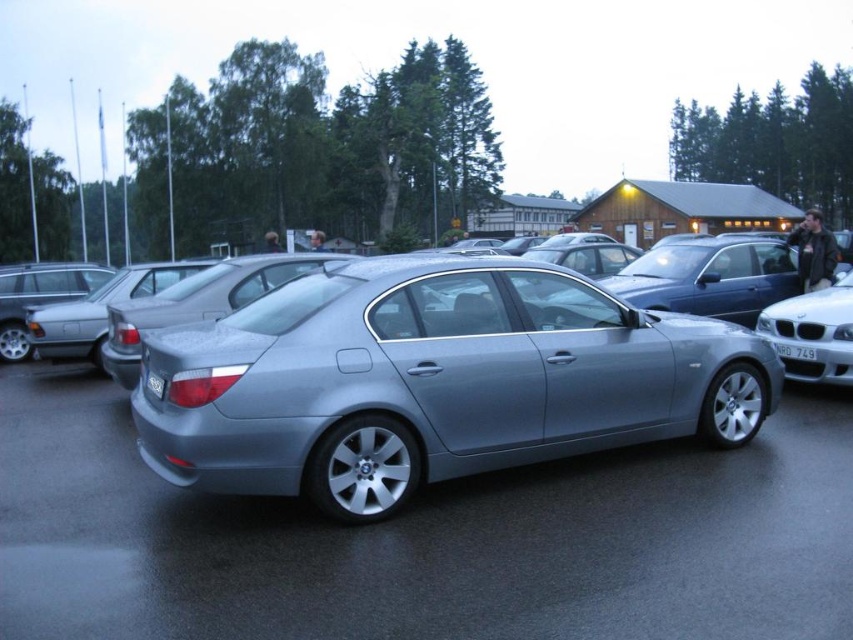
Which is above, white plastic license plate at center or black plastic license plate at center?

white plastic license plate at center is higher up.

Is point (793, 352) behind point (161, 385)?

That is True.

Identify the location of white plastic license plate at center. (795, 352).

Is satin white car at right thinner than white plastic license plate at center?

Incorrect, satin white car at right's width is not less than white plastic license plate at center's.

Between satin white car at right and white plastic license plate at center, which one is positioned higher?

satin white car at right

The width and height of the screenshot is (853, 640). Find the location of `satin white car at right`. satin white car at right is located at coordinates pos(813,333).

Can you confirm if satin white car at right is smaller than black plastic license plate at center?

Incorrect, satin white car at right is not smaller in size than black plastic license plate at center.

Can you confirm if satin white car at right is positioned above black plastic license plate at center?

Indeed, satin white car at right is positioned over black plastic license plate at center.

The height and width of the screenshot is (640, 853). Identify the location of satin white car at right. (813, 333).